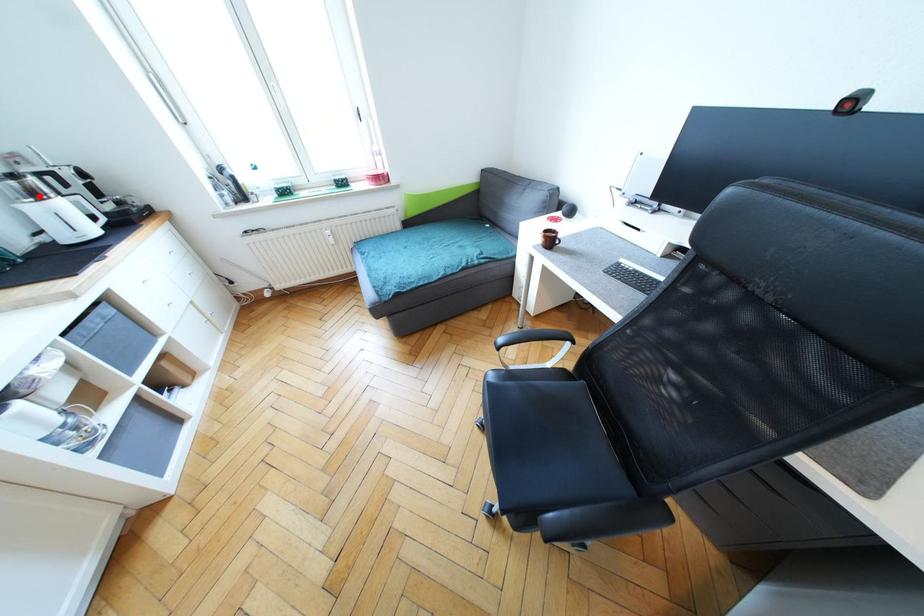
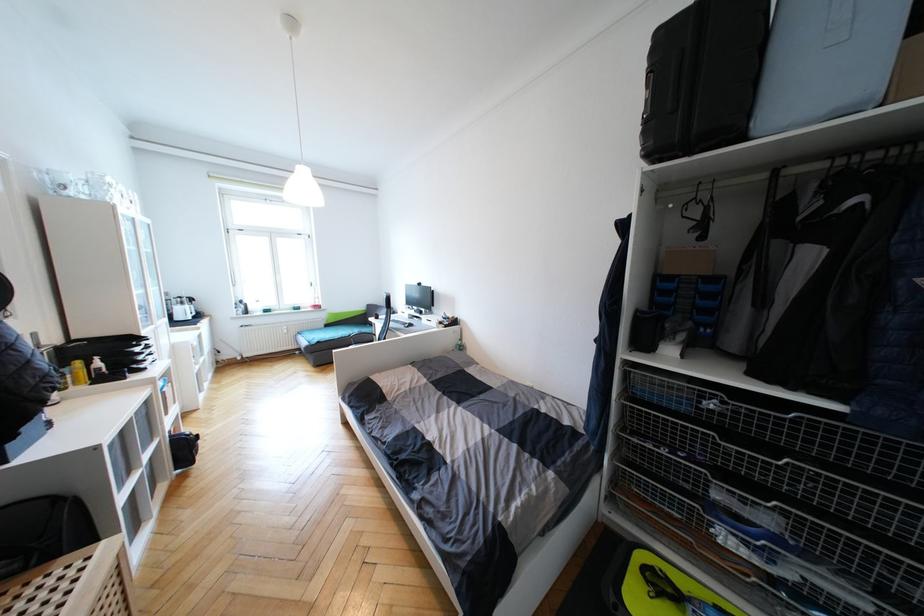
Question: A red point is marked in image1. In image2, is the corresponding 3D point closer to the camera or farther? Reply with the corresponding letter.

Choices:
 (A) The corresponding 3D point is closer.
 (B) The corresponding 3D point is farther.

Answer: (A)